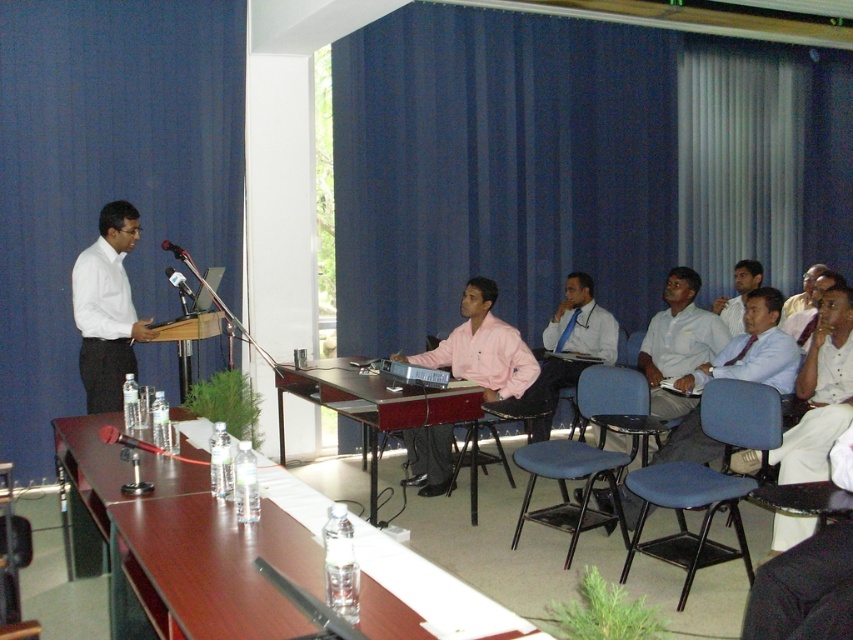
Is brown wood table at center to the left of light pink shirt at center from the viewer's perspective?

Yes, brown wood table at center is to the left of light pink shirt at center.

Does brown wood table at center come behind light pink shirt at center?

That is False.

Who is more forward, (299, 628) or (737, 301)?

Point (299, 628)

The height and width of the screenshot is (640, 853). I want to click on brown wood table at center, so click(190, 540).

Which is more to the right, brown wood table at center or blue fabric chair at center?

blue fabric chair at center

Between brown wood table at center and blue fabric chair at center, which one has more height?

blue fabric chair at center

Describe the element at coordinates (190, 540) in the screenshot. The height and width of the screenshot is (640, 853). I see `brown wood table at center` at that location.

At what (x,y) coordinates should I click in order to perform the action: click on brown wood table at center. Please return your answer as a coordinate pair (x, y). The width and height of the screenshot is (853, 640). Looking at the image, I should click on (190, 540).

Is brown wooden table at center thinner than pink matte shirt at center?

No, brown wooden table at center is not thinner than pink matte shirt at center.

Between point (410, 426) and point (512, 356), which one is positioned in front?

Positioned in front is point (410, 426).

Locate an element on the screen. brown wooden table at center is located at coordinates click(x=370, y=404).